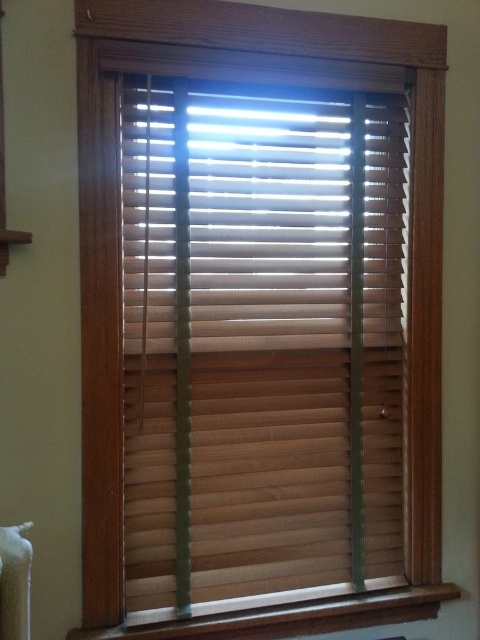
You are an interior designer assessing a room with wooden blinds at center and wooden at lower center. Which object would cast a longer shadow when the sun is directly overhead?

The wooden blinds at center is much taller as wooden at lower center, so it would cast a longer shadow when the sun is directly overhead.

You are trying to clean the wooden blinds at center and the wooden at lower center. Since you have a limited amount of cleaning solution, which object requires more solution based on their size?

The wooden blinds at center requires more cleaning solution because it is larger in size than the wooden at lower center.

You are a window cleaner with a tool that is 50 centimeters long. You need to clean the wooden blinds at center and the wooden at lower center. Can your tool reach between them?

The wooden blinds at center is 50.61 centimeters from wooden at lower center. Since the tool is only 50 centimeters long, it cannot reach the distance between them.